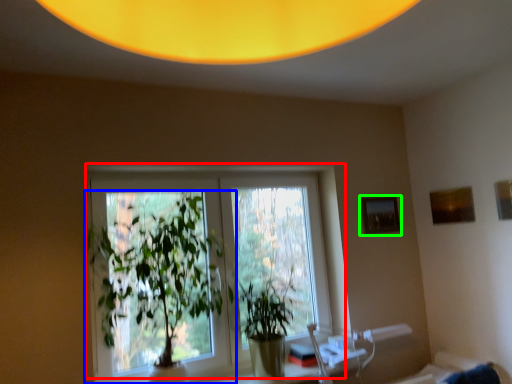
Question: Based on their relative distances, which object is farther from window (highlighted by a red box)? Choose from houseplant (highlighted by a blue box) and picture frame (highlighted by a green box).

Choices:
 (A) houseplant
 (B) picture frame

Answer: (B)